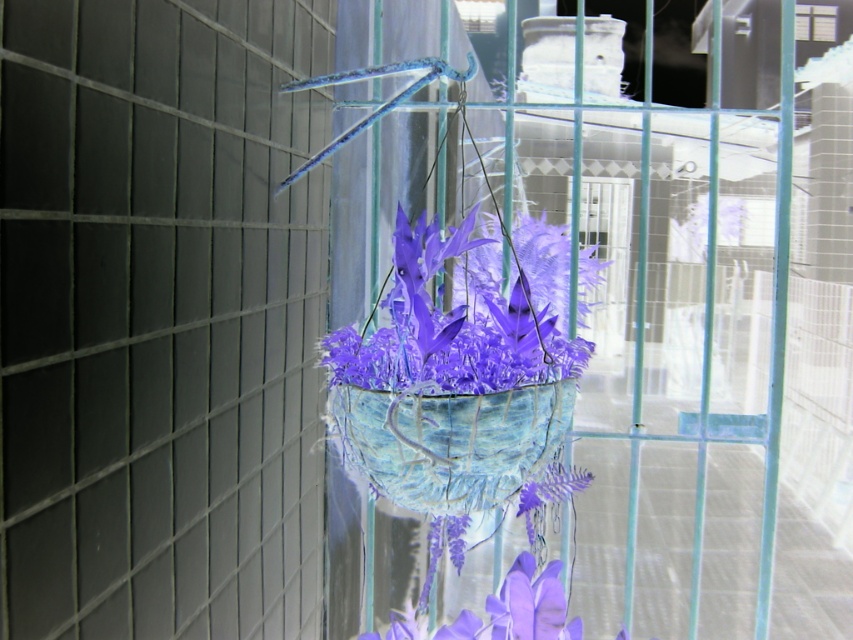
You are an interior designer planning to hang a decorative item in a room. You have a matte purple paper flowers at center and a textured blue basket at center. The two items are 9.08 inches apart. If you want to place them closer together, which one should you move and in which direction?

Since the matte purple paper flowers at center and textured blue basket at center are 9.08 inches apart, you can move either object toward the other to reduce the distance between them. Moving either one closer would achieve the desired result.

You are looking at the hanging basket and notice two points marked on the window frame. The first point is at coordinate (489, 252) and the second at (448, 416). From your perspective, which point is closer to you?

Point (448, 416) is closer to you because it is less further to the camera than point (489, 252).

You are an interior designer planning to place a decorative item in a small living room. You have the matte blue fabric basket at center and the matte purple paper flowers at center. Which object would you choose if you want something narrower to fit in a tight space?

The matte blue fabric basket at center has a lesser width compared to the matte purple paper flowers at center, so it would be the better choice for a tight space.